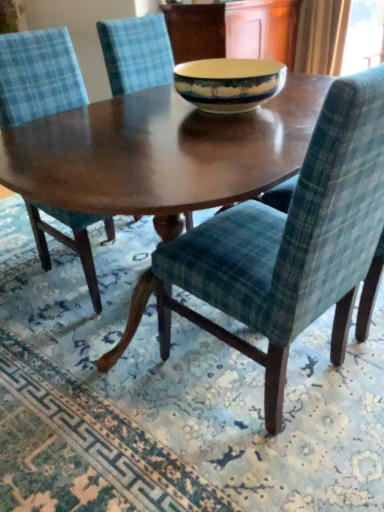
Locate an element on the screen. free space that is to the left of matte ceramic bowl at center is located at coordinates (129, 114).